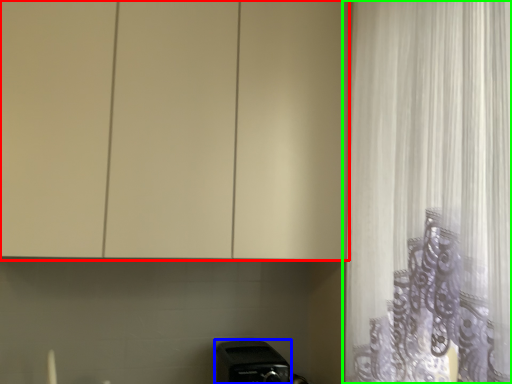
Question: Based on their relative distances, which object is farther from cabinetry (highlighted by a red box)? Choose from appliance (highlighted by a blue box) and curtain (highlighted by a green box).

Choices:
 (A) appliance
 (B) curtain

Answer: (A)